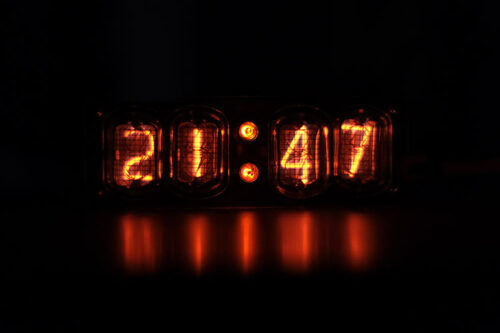
Find the location of a particular element. The image size is (500, 333). led clock readout is located at coordinates (217, 147).